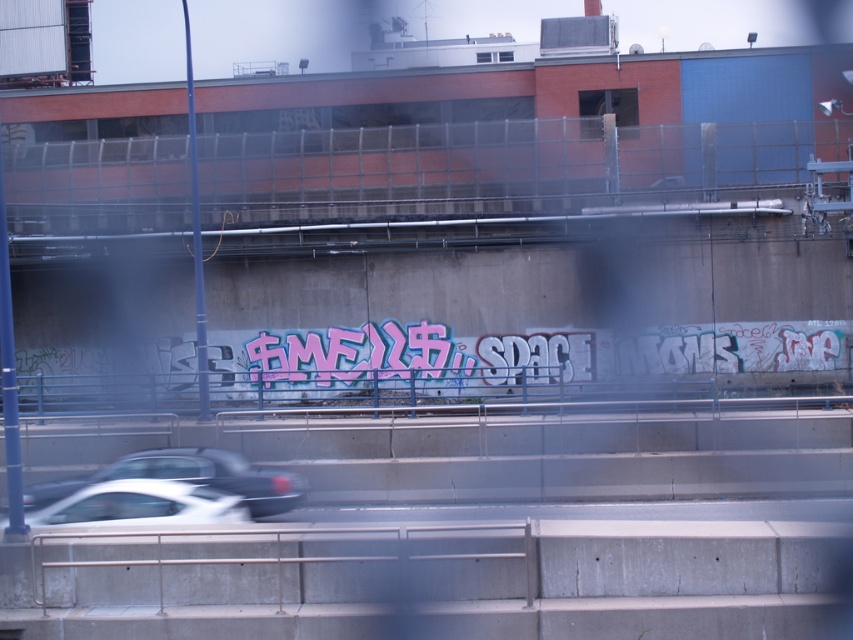
Question: Which object is farther from the camera taking this photo?

Choices:
 (A) white glossy car at lower left
 (B) white glossy car at lower center
 (C) blue metal fence at center

Answer: (A)

Question: Can you confirm if blue metal fence at center is thinner than white glossy car at lower center?

Choices:
 (A) no
 (B) yes

Answer: (A)

Question: Observing the image, what is the correct spatial positioning of white glossy car at lower left in reference to white glossy car at lower center?

Choices:
 (A) above
 (B) below

Answer: (A)

Question: Based on their relative distances, which object is nearer to the white glossy car at lower left?

Choices:
 (A) blue metal fence at center
 (B) white glossy car at lower center

Answer: (B)

Question: Which is nearer to the blue metal fence at center?

Choices:
 (A) white glossy car at lower left
 (B) white glossy car at lower center

Answer: (B)

Question: Does blue metal fence at center appear over white glossy car at lower center?

Choices:
 (A) yes
 (B) no

Answer: (A)